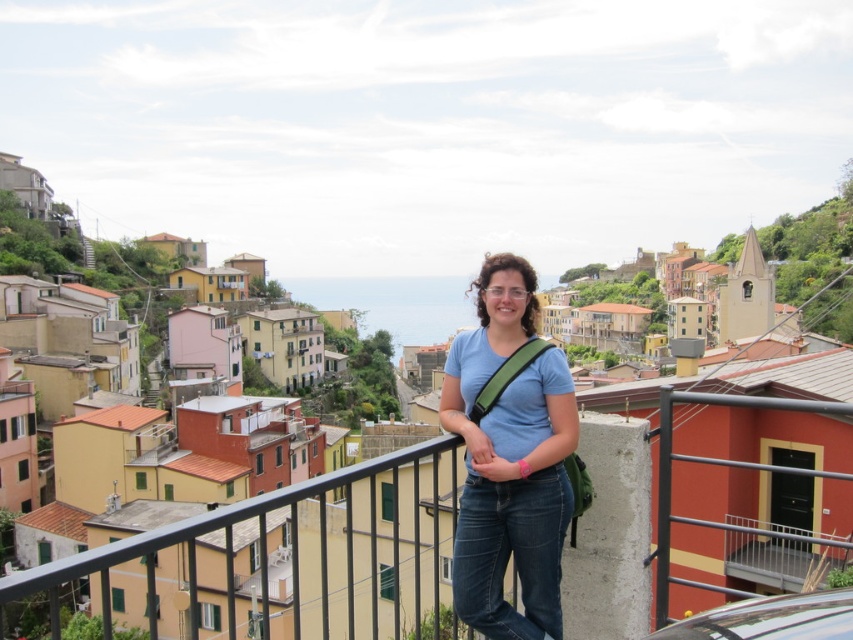
You are standing on the balcony and want to take a photo of the coastal town. You notice two points in the scene labeled as point (560,419) and point (769,524). Which point is closer to you when you take the photo?

Point (560,419) is closer to the camera than point (769,524), so it will appear closer to you in the photo.

You are an architect designing a new balcony for a coastal town house. You need to ensure that the view of the colorful buildings is not obstructed by the person standing on the balcony. Based on the image, what is the minimum height in meters that the railing should be to block the person wearing the matte blue shirt at center from blocking the view of the buildings?

The minimum height required for the railing would need to be at least the height of the person up to the point where their line of sight aligns with the base of the buildings. However, since the exact height of the person and the distance to the buildings are not provided in the scene description, an accurate calculation cannot be made. The available data only specifies the 2D coordinates of the matte blue shirt at center as point (509,460), which does not provide sufficient information about depth or 3D